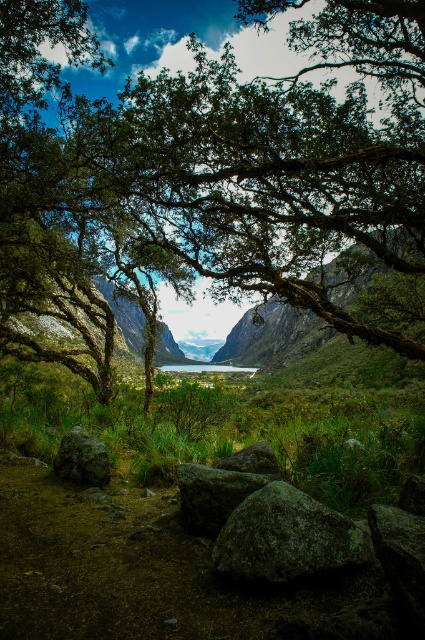
Can you confirm if green mossy rock at center is thinner than rocky cliff at center?

Correct, green mossy rock at center's width is less than rocky cliff at center's.

In the scene shown: Which is more to the left, green mossy rock at center or rocky cliff at center?

From the viewer's perspective, rocky cliff at center appears more on the left side.

Which is in front, point (232, 353) or point (156, 344)?

Point (156, 344) is more forward.

The height and width of the screenshot is (640, 425). What are the coordinates of `green mossy rock at center` in the screenshot? It's located at (336, 308).

Between green leafy tree at center and rough textured rock at lower left, which one has less height?

With less height is rough textured rock at lower left.

Which of these two, green leafy tree at center or rough textured rock at lower left, stands taller?

green leafy tree at center

Is point (198, 124) positioned in front of point (62, 468)?

No.

Locate an element on the screen. The image size is (425, 640). green leafy tree at center is located at coordinates (206, 173).

Between gray rough boulder at lower center and rough textured rock at lower left, which one has less height?

With less height is rough textured rock at lower left.

Between point (243, 500) and point (82, 461), which one is positioned behind?

Positioned behind is point (82, 461).

Measure the distance between gray rough boulder at lower center and camera.

4.27 meters

I want to click on gray rough boulder at lower center, so click(x=286, y=536).